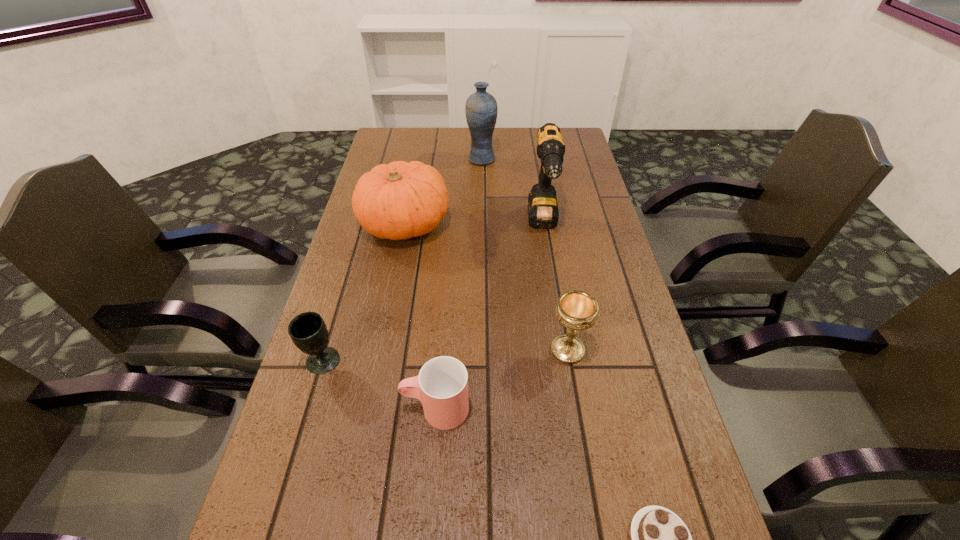
This screenshot has width=960, height=540. In order to click on object that is the fifth closest one to the left chalice in this screenshot , I will do `click(543, 212)`.